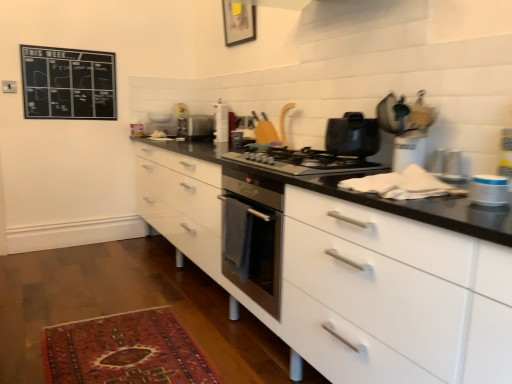
Question: Is satin black gas stove at center wider or thinner than white glossy toaster at center, the 2th appliance from the left?

Choices:
 (A) thin
 (B) wide

Answer: (B)

Question: From a real-world perspective, is satin black gas stove at center above or below white glossy toaster at center, which appears as the 3th appliance when viewed from the right?

Choices:
 (A) above
 (B) below

Answer: (B)

Question: Based on their relative distances, which object is farther from the carpeted rug at lower left?

Choices:
 (A) white matte container at upper right, which is counted as the third appliance, starting from the left
 (B) wooden picture frame at upper center
 (C) white plastic container at right, positioned as the 1th appliance in front-to-back order
 (D) black chalkboard at upper left
 (E) white glossy toaster at center, which appears as the 3th appliance when viewed from the right

Answer: (B)

Question: Estimate the real-world distances between objects in this image. Which object is closer to the satin black gas stove at center?

Choices:
 (A) black chalkboard at upper left
 (B) carpeted rug at lower left
 (C) satin silver toaster at center, the 4th appliance viewed from the front
 (D) white matte container at upper right, marked as the third appliance in a back-to-front arrangement
 (E) white glossy toaster at center, the 3th appliance positioned from the bottom

Answer: (D)